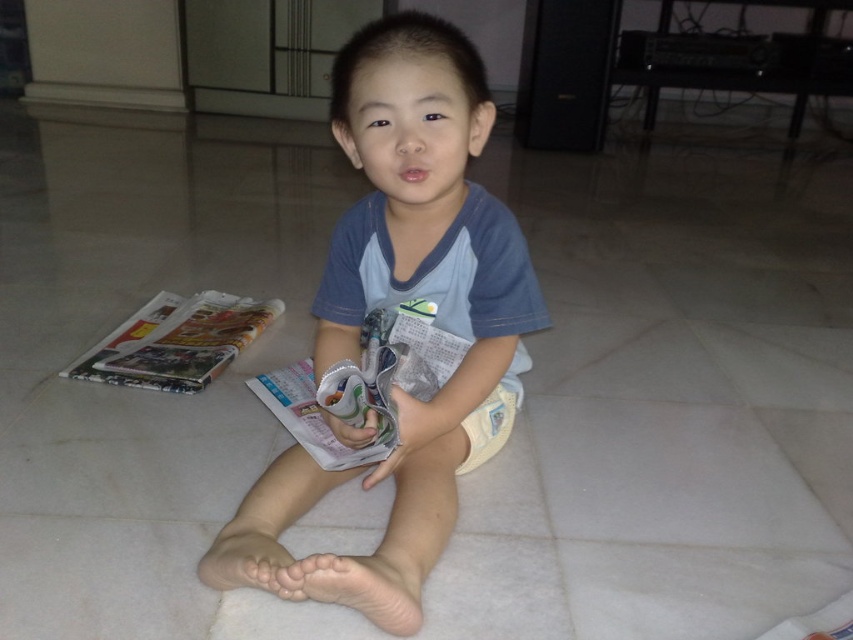
Question: Among these objects, which one is farthest from the camera?

Choices:
 (A) printed paper magazine at center
 (B) blue cotton shirt at center
 (C) printed paper magazine at left

Answer: (C)

Question: Can you confirm if blue cotton shirt at center is thinner than printed paper magazine at left?

Choices:
 (A) no
 (B) yes

Answer: (A)

Question: Which point appears farthest from the camera in this image?

Choices:
 (A) (201, 348)
 (B) (485, 436)
 (C) (337, 401)

Answer: (A)

Question: Is blue cotton shirt at center positioned behind printed paper magazine at left?

Choices:
 (A) no
 (B) yes

Answer: (A)

Question: Which of the following is the farthest from the observer?

Choices:
 (A) (448, 253)
 (B) (424, 346)
 (C) (219, 332)

Answer: (C)

Question: Does printed paper magazine at center have a lesser width compared to printed paper magazine at left?

Choices:
 (A) no
 (B) yes

Answer: (A)